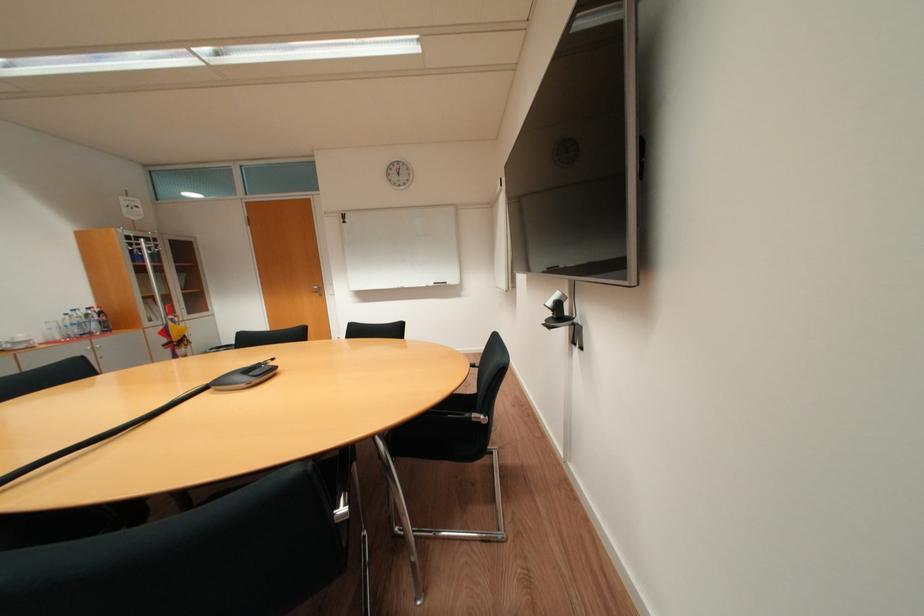
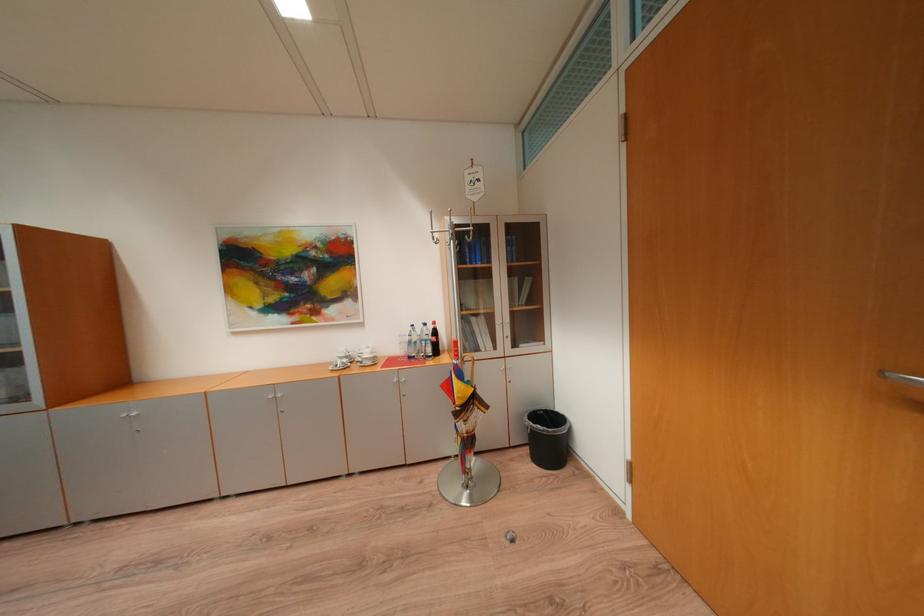
Locate, in the second image, the point that corresponds to point (174, 334) in the first image.

(456, 387)